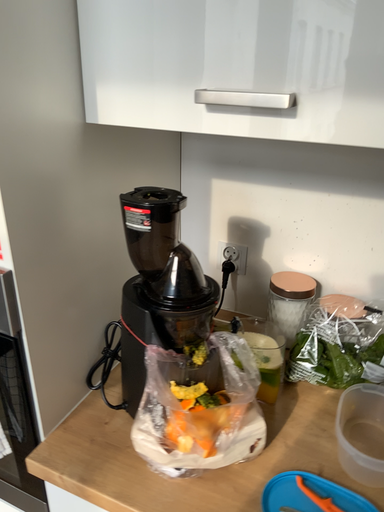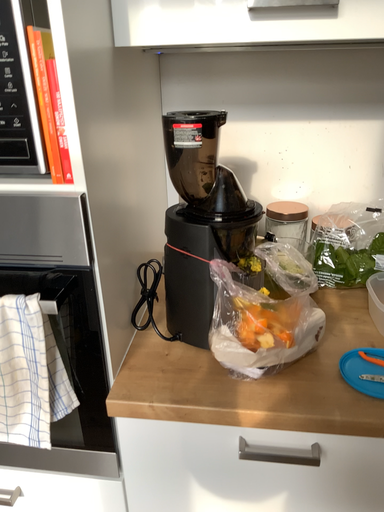
Question: How did the camera likely rotate when shooting the video?

Choices:
 (A) rotated left
 (B) rotated right

Answer: (B)